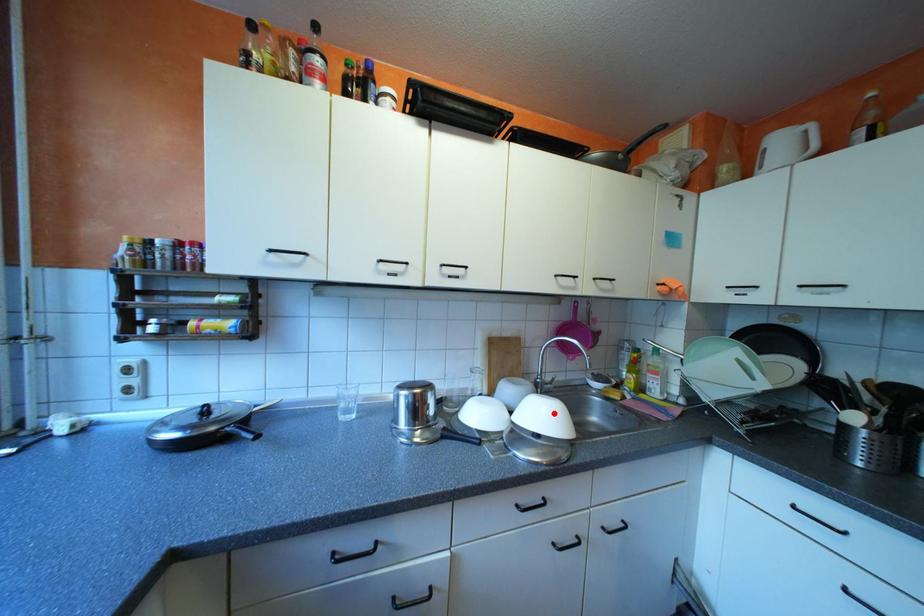
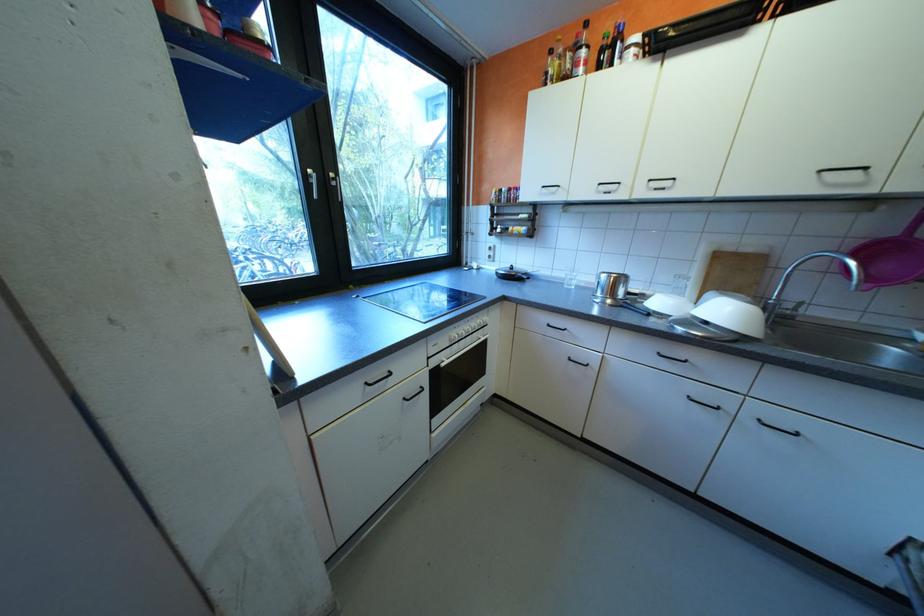
Locate, in the second image, the point that corresponds to the highlighted location in the first image.

(736, 312)